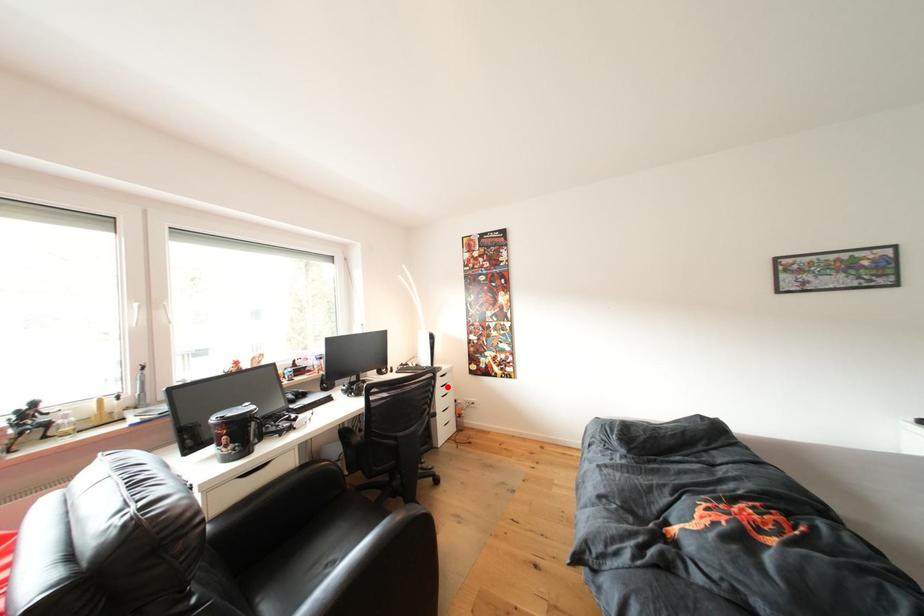
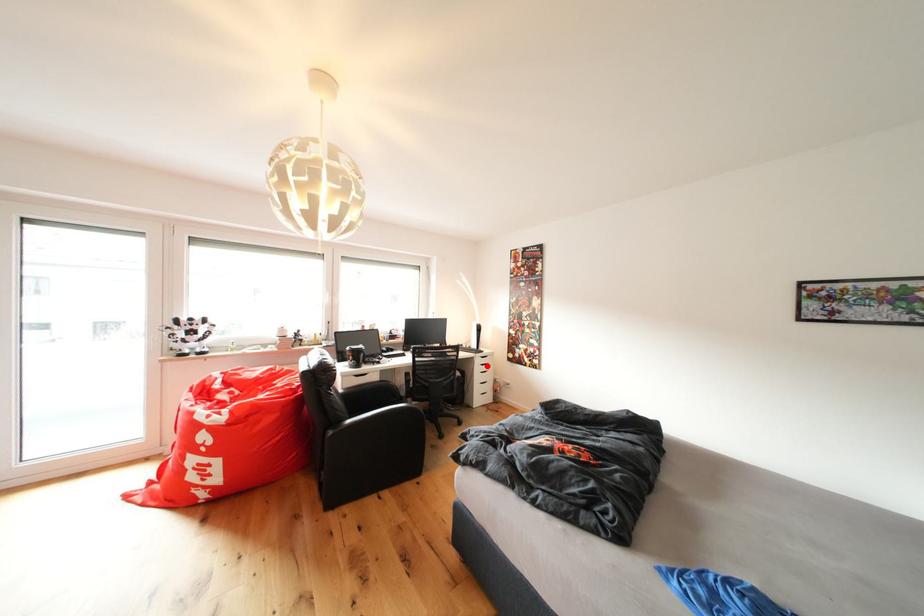
I am providing you with two images of the same scene from different viewpoints. A red point is marked on the first image and another point is marked on the second image. Does the point marked in image1 correspond to the same location as the one in image2?

Yes